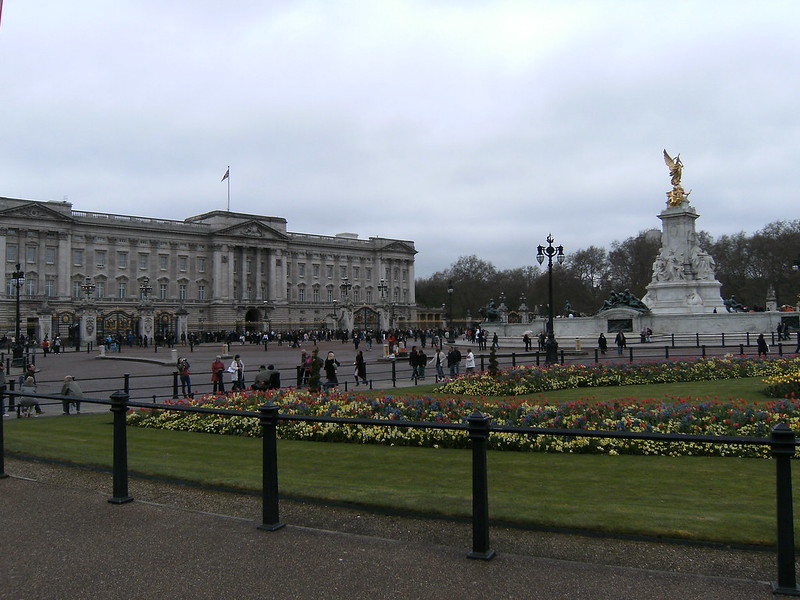
The image size is (800, 600). What are the coordinates of `columns` in the screenshot? It's located at (258, 276), (246, 277).